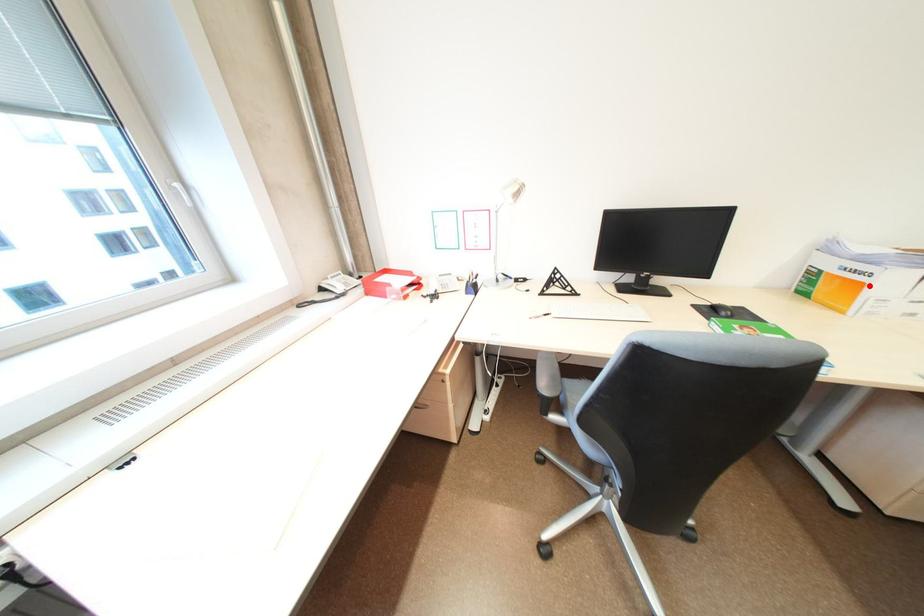
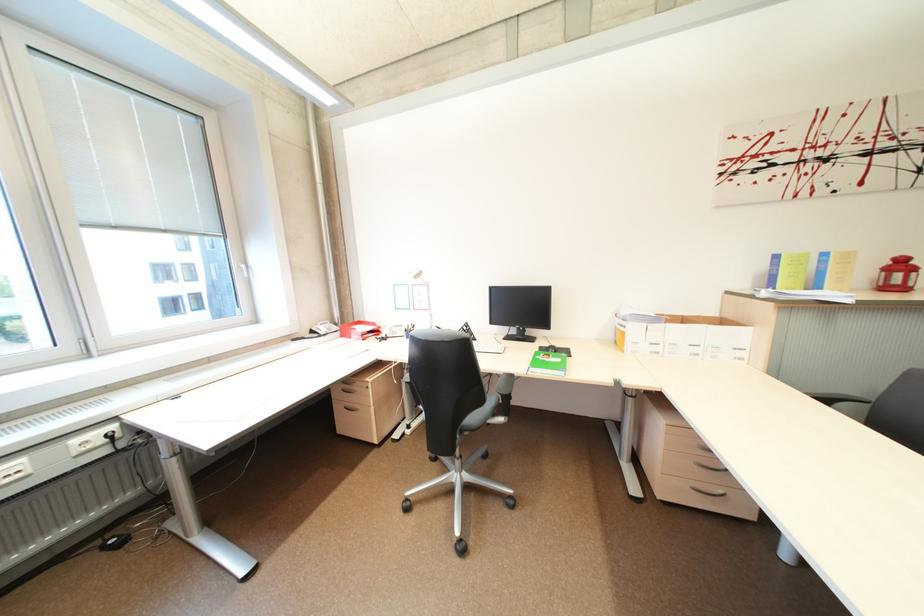
Where in the second image is the point corresponding to the highlighted location from the first image?

(633, 334)